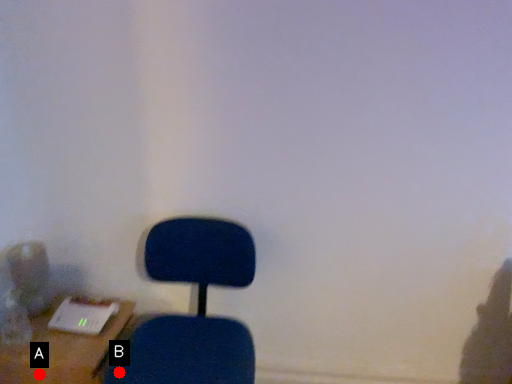
Question: Two points are circled on the image, labeled by A and B beside each circle. Which point is closer to the camera?

Choices:
 (A) A is closer
 (B) B is closer

Answer: (B)